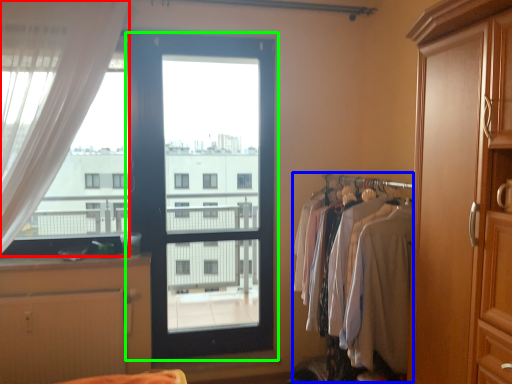
Question: Based on their relative distances, which object is farther from curtain (highlighted by a red box)? Choose from laundry (highlighted by a blue box) and door (highlighted by a green box).

Choices:
 (A) laundry
 (B) door

Answer: (B)